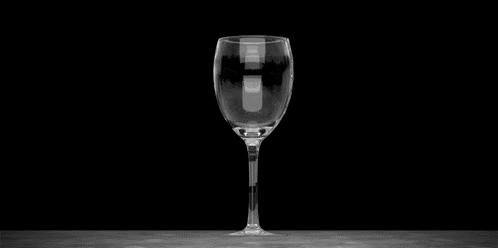
The image size is (498, 248). In order to click on base of glass in this screenshot , I will do `click(258, 230)`.